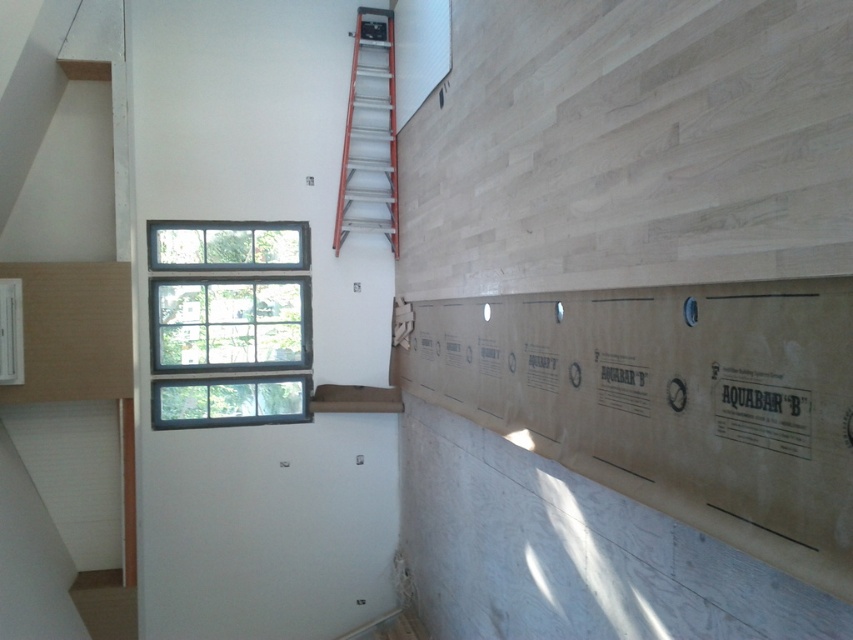
Question: Is clear glass window at upper left positioned before orange fiberglass ladder at upper center?

Choices:
 (A) no
 (B) yes

Answer: (B)

Question: Which of the following is the farthest from the observer?

Choices:
 (A) (207, 378)
 (B) (369, 20)

Answer: (B)

Question: Is clear glass window at upper left to the right of orange fiberglass ladder at upper center from the viewer's perspective?

Choices:
 (A) no
 (B) yes

Answer: (A)

Question: Which point is closer to the camera taking this photo?

Choices:
 (A) (376, 176)
 (B) (222, 259)

Answer: (B)

Question: Which of the following is the closest to the observer?

Choices:
 (A) (355, 26)
 (B) (189, 364)

Answer: (B)

Question: Can you confirm if clear glass window at upper left is positioned to the right of orange fiberglass ladder at upper center?

Choices:
 (A) no
 (B) yes

Answer: (A)